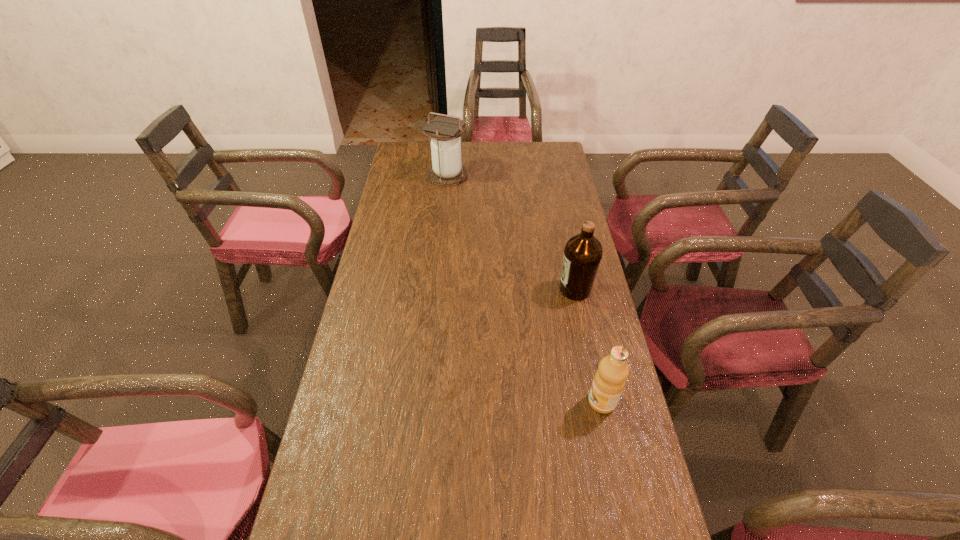
Where is `blank area located 0.310m on the label of the shortest object`? Image resolution: width=960 pixels, height=540 pixels. blank area located 0.310m on the label of the shortest object is located at coordinates (464, 402).

Find the location of a particular element. The width and height of the screenshot is (960, 540). vacant space located on the label of the shortest object is located at coordinates (496, 402).

The height and width of the screenshot is (540, 960). Identify the location of free space located on the label of the shortest object. (480, 402).

Where is `object that is positioned at the far edge`? Image resolution: width=960 pixels, height=540 pixels. object that is positioned at the far edge is located at coordinates (447, 169).

Where is `object located at the left edge`? The image size is (960, 540). object located at the left edge is located at coordinates (447, 169).

This screenshot has width=960, height=540. In order to click on object present at the far left corner in this screenshot , I will do `click(447, 169)`.

I want to click on free region at the far edge of the desktop, so click(x=480, y=162).

At what (x,y) coordinates should I click in order to perform the action: click on free region at the left edge. Please return your answer as a coordinate pair (x, y). The image size is (960, 540). Looking at the image, I should click on (363, 313).

This screenshot has height=540, width=960. Find the location of `blank space at the right edge`. blank space at the right edge is located at coordinates (632, 475).

Locate an element on the screen. vacant space in between the nearer olive oil and the taller olive oil is located at coordinates (588, 346).